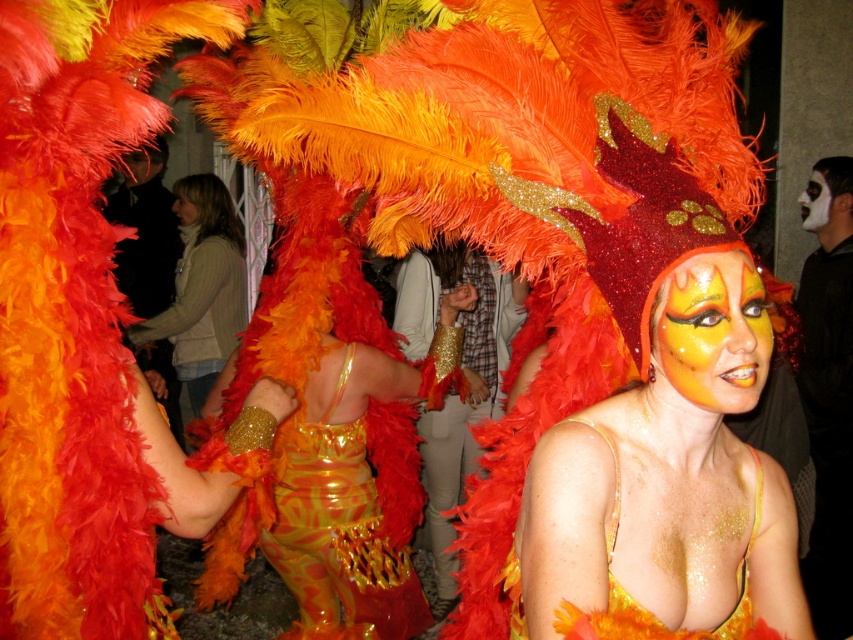
Which of these two, shiny gold costume at center or shiny gold dress at center, stands shorter?

shiny gold costume at center is shorter.

Between point (695, 541) and point (343, 524), which one is positioned behind?

Positioned behind is point (343, 524).

The height and width of the screenshot is (640, 853). I want to click on shiny gold costume at center, so click(x=668, y=477).

Is matte orange feather boa at center positioned in front of white matte face at center?

No, matte orange feather boa at center is further to the viewer.

Describe the element at coordinates (202, 291) in the screenshot. Image resolution: width=853 pixels, height=640 pixels. I see `matte orange feather boa at center` at that location.

Is point (241, 317) behind point (817, 186)?

Yes, point (241, 317) is farther from viewer.

I want to click on matte orange feather boa at center, so click(202, 291).

What do you see at coordinates (202, 291) in the screenshot? I see `matte orange feather boa at center` at bounding box center [202, 291].

Between point (177, 333) and point (142, 180), which one is positioned in front?

Point (177, 333) is in front.

Between point (184, 234) and point (132, 170), which one is positioned in front?

Positioned in front is point (184, 234).

Identify the location of matte orange feather boa at center. (202, 291).